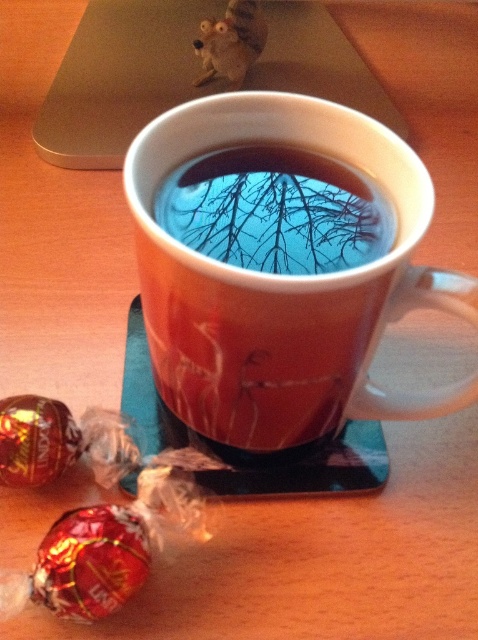
Question: Which point is farther to the camera?

Choices:
 (A) (206, 244)
 (B) (36, 600)
 (C) (400, 132)
 (D) (335, 304)

Answer: (C)

Question: Is silver metallic laptop at upper center bigger than transparent glass tea at center?

Choices:
 (A) yes
 (B) no

Answer: (A)

Question: Which point is farther from the camera taking this photo?

Choices:
 (A) (32, 440)
 (B) (184, 6)
 (C) (74, 573)
 (D) (328, 195)

Answer: (B)

Question: Can you confirm if matte ceramic mug at center is thinner than shiny metallic lollipop at lower left?

Choices:
 (A) no
 (B) yes

Answer: (A)

Question: Which is nearer to the transparent glass tea at center?

Choices:
 (A) silver metallic laptop at upper center
 (B) matte ceramic mug at center

Answer: (B)

Question: From the image, what is the correct spatial relationship of matte ceramic mug at center in relation to shiny metallic lollipop at lower left?

Choices:
 (A) below
 (B) above

Answer: (B)